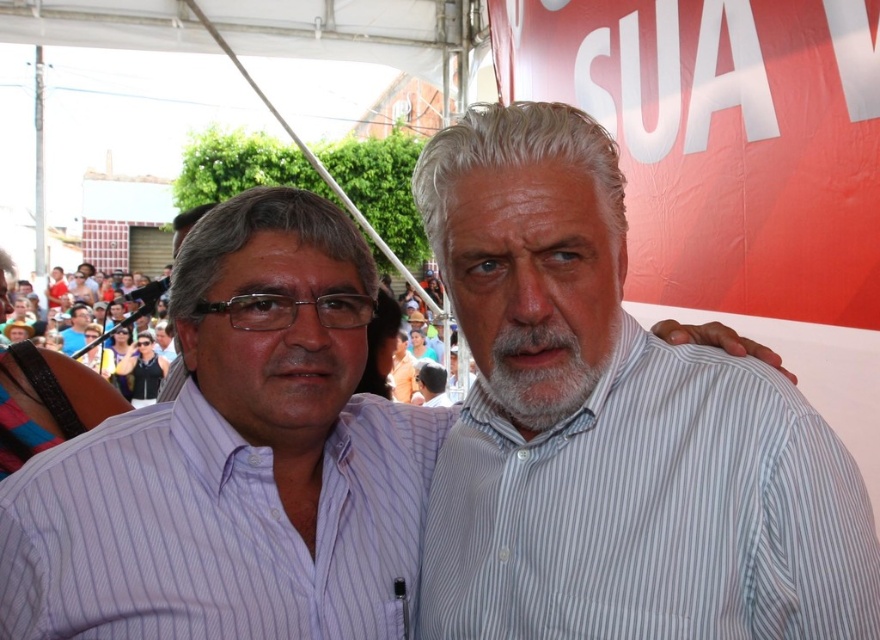
Question: Does white striped shirt at center have a larger size compared to purple striped shirt at center?

Choices:
 (A) yes
 (B) no

Answer: (A)

Question: Can you confirm if white striped shirt at center is smaller than white striped shirt at right?

Choices:
 (A) yes
 (B) no

Answer: (B)

Question: Which object is farther from the camera taking this photo?

Choices:
 (A) white striped shirt at center
 (B) purple striped shirt at center

Answer: (A)

Question: Where is white striped shirt at right located in relation to multicolored fabric crowd at center in the image?

Choices:
 (A) right
 (B) left

Answer: (A)

Question: Based on their relative distances, which object is farther from the purple striped shirt at center?

Choices:
 (A) white striped shirt at right
 (B) white striped shirt at center
 (C) multicolored fabric crowd at center

Answer: (C)

Question: Which point is closer to the camera?

Choices:
 (A) (633, 388)
 (B) (195, 310)
 (C) (143, 301)

Answer: (A)